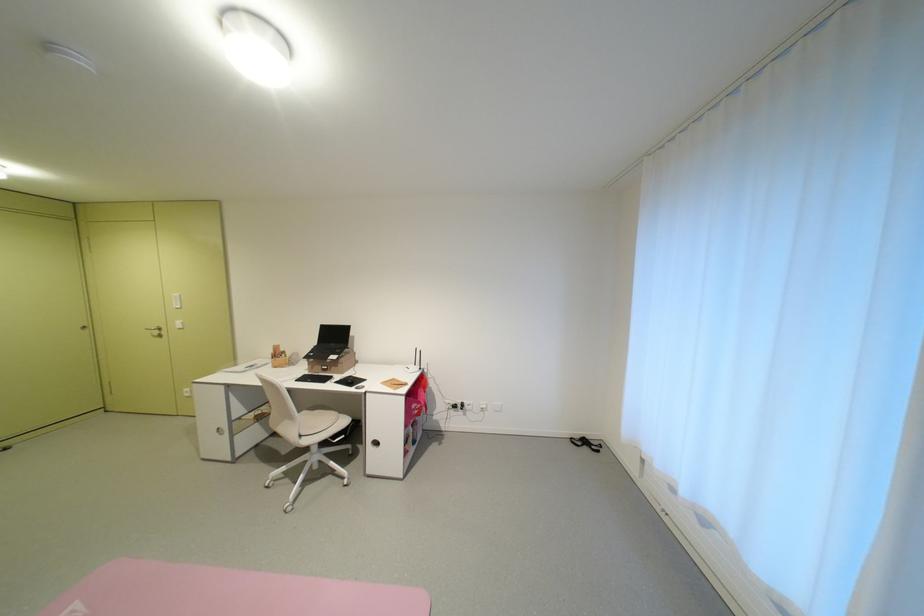
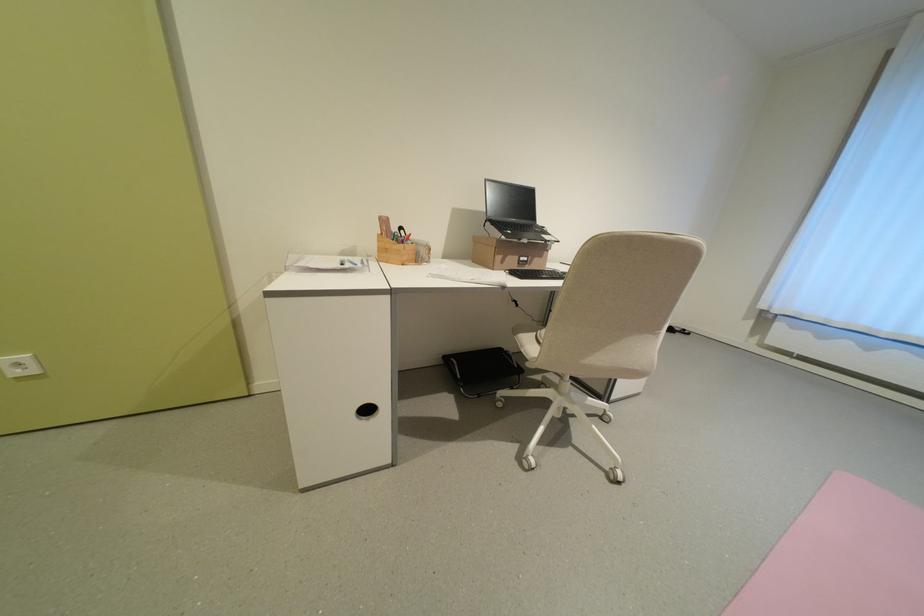
The point at [335,369] is marked in the first image. Where is the corresponding point in the second image?

(536, 261)